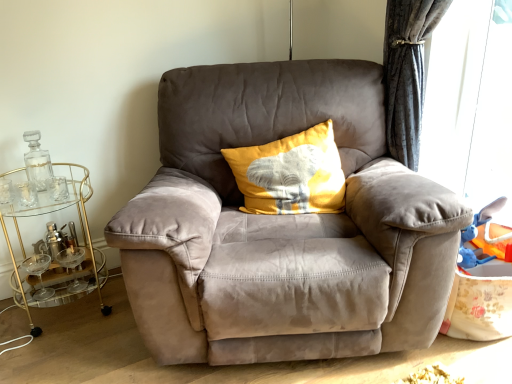
Question: Considering the relative sizes of clear glass bottle at left and transparent plastic window screen at right in the image provided, is clear glass bottle at left bigger than transparent plastic window screen at right?

Choices:
 (A) no
 (B) yes

Answer: (A)

Question: Is the depth of clear glass bottle at left less than that of transparent plastic window screen at right?

Choices:
 (A) yes
 (B) no

Answer: (B)

Question: Could transparent plastic window screen at right be considered to be inside clear glass bottle at left?

Choices:
 (A) no
 (B) yes

Answer: (A)

Question: Is clear glass bottle at left outside transparent plastic window screen at right?

Choices:
 (A) yes
 (B) no

Answer: (A)

Question: Does clear glass bottle at left have a greater height compared to transparent plastic window screen at right?

Choices:
 (A) no
 (B) yes

Answer: (A)

Question: Does clear glass bottle at left have a smaller size compared to transparent plastic window screen at right?

Choices:
 (A) yes
 (B) no

Answer: (A)

Question: From the image's perspective, is gold glass bar cart at left above clear glass bottle at left?

Choices:
 (A) no
 (B) yes

Answer: (A)

Question: From a real-world perspective, is gold glass bar cart at left physically below clear glass bottle at left?

Choices:
 (A) yes
 (B) no

Answer: (A)

Question: Does gold glass bar cart at left have a larger size compared to clear glass bottle at left?

Choices:
 (A) no
 (B) yes

Answer: (B)

Question: Is gold glass bar cart at left closer to camera compared to clear glass bottle at left?

Choices:
 (A) no
 (B) yes

Answer: (B)

Question: Can you confirm if gold glass bar cart at left is wider than clear glass bottle at left?

Choices:
 (A) no
 (B) yes

Answer: (B)

Question: Is the depth of gold glass bar cart at left greater than that of clear glass bottle at left?

Choices:
 (A) no
 (B) yes

Answer: (A)

Question: From the image's perspective, does yellow fabric pillow at center appear higher than clear glass bottle at left?

Choices:
 (A) yes
 (B) no

Answer: (A)